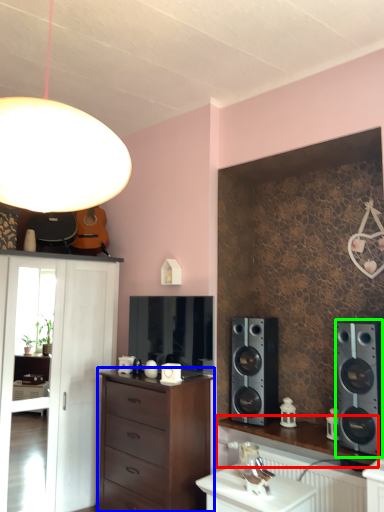
Question: Considering the real-world distances, which object is farthest from desk (highlighted by a red box)? chest of drawers (highlighted by a blue box) or speaker (highlighted by a green box)?

Choices:
 (A) chest of drawers
 (B) speaker

Answer: (A)